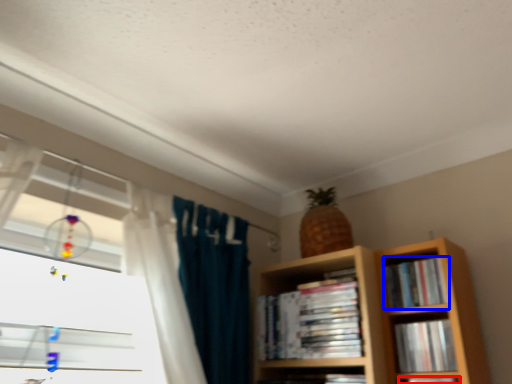
Question: Which of the following is the farthest to the observer, book (highlighted by a red box) or book (highlighted by a blue box)?

Choices:
 (A) book
 (B) book

Answer: (B)